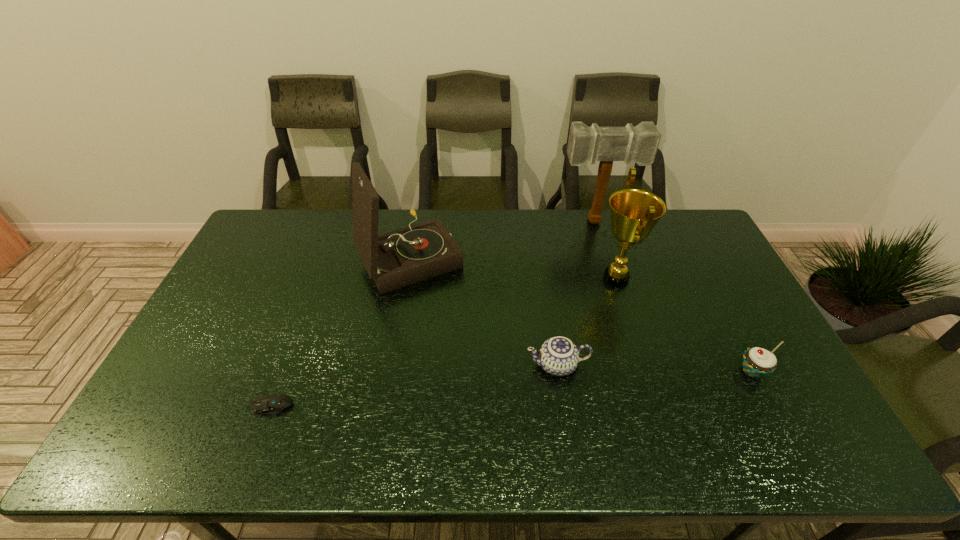
The height and width of the screenshot is (540, 960). In the image, there is a desktop. Find the location of `vacant space at the far edge`. vacant space at the far edge is located at coordinates (615, 241).

This screenshot has height=540, width=960. What are the coordinates of `free space at the near edge` in the screenshot? It's located at (663, 431).

Locate an element on the screen. vacant space at the far left corner of the desktop is located at coordinates (260, 225).

In order to click on vacant area that lies between the fifth object from right to left and the mallet in this screenshot , I will do tap(503, 239).

In order to click on free space between the mallet and the award in this screenshot , I will do `click(606, 250)`.

The height and width of the screenshot is (540, 960). What are the coordinates of `unoccupied area between the leftmost object and the phonograph record` in the screenshot? It's located at (340, 332).

Image resolution: width=960 pixels, height=540 pixels. Identify the location of vacant space that's between the chinaware and the shortest object. (413, 386).

The height and width of the screenshot is (540, 960). Find the location of `vacant area that lies between the chinaware and the phonograph record`. vacant area that lies between the chinaware and the phonograph record is located at coordinates (484, 311).

Locate an element on the screen. The width and height of the screenshot is (960, 540). vacant space that is in between the award and the chinaware is located at coordinates (587, 322).

I want to click on empty location between the second object from left to right and the mallet, so click(503, 239).